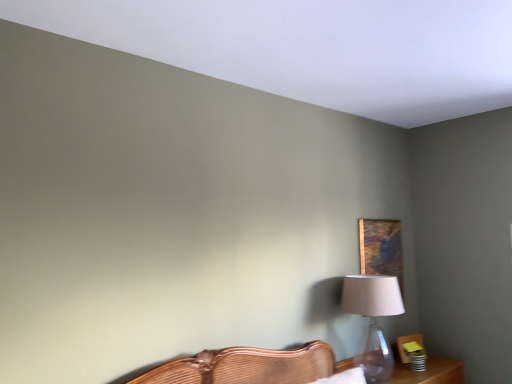
Question: Considering the positions of wooden table at lower right and translucent glass table lamp at right in the image, is wooden table at lower right wider or thinner than translucent glass table lamp at right?

Choices:
 (A) wide
 (B) thin

Answer: (A)

Question: Based on their positions, is wooden table at lower right located to the left or right of translucent glass table lamp at right?

Choices:
 (A) left
 (B) right

Answer: (B)

Question: Based on their relative distances, which object is nearer to the wooden painting at upper right?

Choices:
 (A) wooden table at lower right
 (B) translucent glass table lamp at right

Answer: (B)

Question: Which is nearer to the wooden painting at upper right?

Choices:
 (A) translucent glass table lamp at right
 (B) wooden table at lower right

Answer: (A)